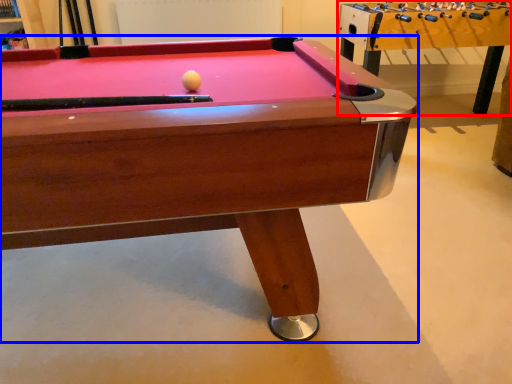
Question: Which object is closer to the camera taking this photo, table (highlighted by a red box) or billiard table (highlighted by a blue box)?

Choices:
 (A) table
 (B) billiard table

Answer: (B)